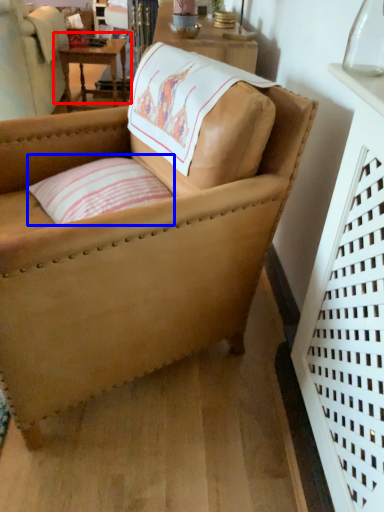
Question: Which of the following is the closest to the observer, table (highlighted by a red box) or pillow (highlighted by a blue box)?

Choices:
 (A) table
 (B) pillow

Answer: (B)